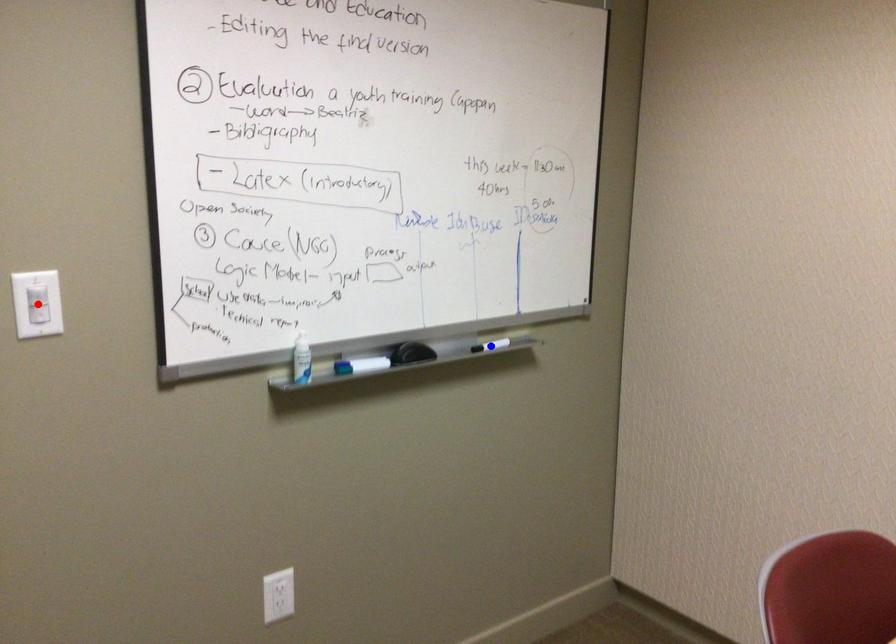
Question: Two points are marked on the image. Which point is closer to the camera?

Choices:
 (A) Blue point is closer.
 (B) Red point is closer.

Answer: (B)